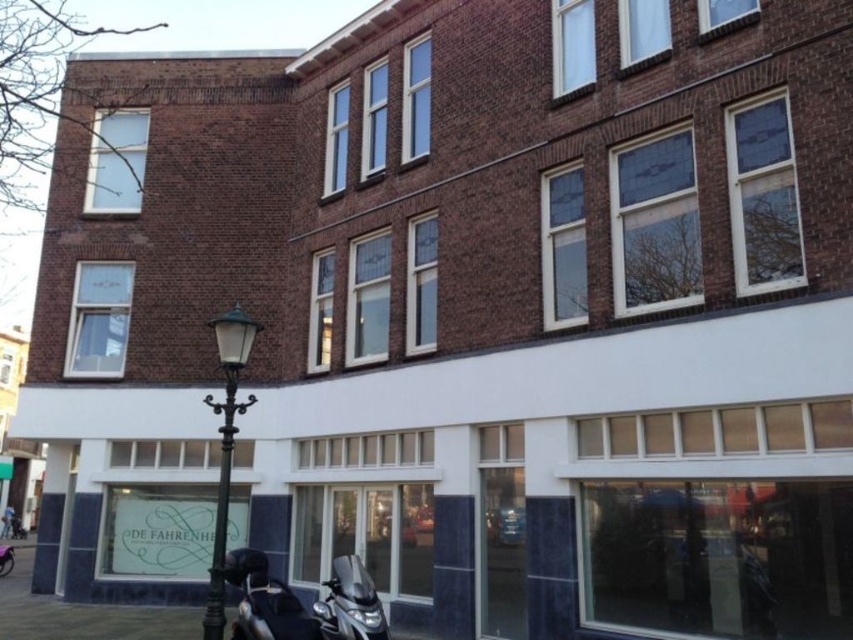
Does black wrought iron streetlight at lower left have a greater height compared to shiny black motorcycle at lower left?

In fact, black wrought iron streetlight at lower left may be shorter than shiny black motorcycle at lower left.

Who is taller, black wrought iron streetlight at lower left or shiny black motorcycle at lower left?

Standing taller between the two is shiny black motorcycle at lower left.

Is point (218, 576) farther from camera compared to point (262, 628)?

Yes, it is behind point (262, 628).

Where is `black wrought iron streetlight at lower left`? This screenshot has width=853, height=640. black wrought iron streetlight at lower left is located at coordinates (225, 445).

Is shiny black motorcycle at lower left thinner than shiny metallic motorcycle at lower center?

In fact, shiny black motorcycle at lower left might be wider than shiny metallic motorcycle at lower center.

Where is `shiny black motorcycle at lower left`? The height and width of the screenshot is (640, 853). shiny black motorcycle at lower left is located at coordinates (265, 600).

Locate an element on the screen. Image resolution: width=853 pixels, height=640 pixels. shiny black motorcycle at lower left is located at coordinates (265, 600).

Can you confirm if black wrought iron streetlight at lower left is positioned below shiny metallic motorcycle at lower center?

No, black wrought iron streetlight at lower left is not below shiny metallic motorcycle at lower center.

Is black wrought iron streetlight at lower left wider than shiny metallic motorcycle at lower center?

In fact, black wrought iron streetlight at lower left might be narrower than shiny metallic motorcycle at lower center.

Locate an element on the screen. The image size is (853, 640). black wrought iron streetlight at lower left is located at coordinates (225, 445).